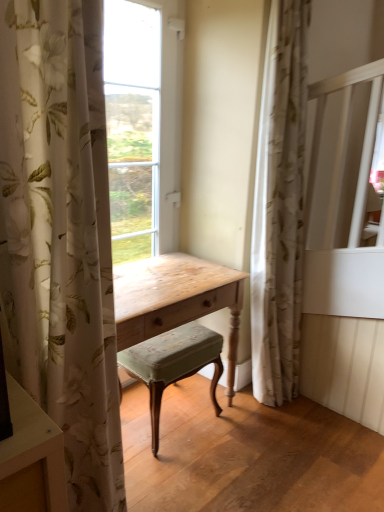
Question: From a real-world perspective, is velvet green cushioned stool at center on top of floral sheer curtain at right, which ranks as the second curtain in left-to-right order?

Choices:
 (A) no
 (B) yes

Answer: (A)

Question: Can you confirm if velvet green cushioned stool at center is shorter than floral sheer curtain at right, the first curtain from the back?

Choices:
 (A) yes
 (B) no

Answer: (A)

Question: Can you confirm if velvet green cushioned stool at center is smaller than floral sheer curtain at right, the second curtain viewed from the front?

Choices:
 (A) no
 (B) yes

Answer: (B)

Question: Does velvet green cushioned stool at center appear on the left side of floral sheer curtain at right, which ranks as the second curtain in left-to-right order?

Choices:
 (A) yes
 (B) no

Answer: (A)

Question: Is velvet green cushioned stool at center placed right next to floral sheer curtain at right, acting as the first curtain starting from the right?

Choices:
 (A) no
 (B) yes

Answer: (A)

Question: Is floral sheer curtain at right, the first curtain from the back, to the left or to the right of white floral fabric curtain at left, arranged as the 1th curtain when viewed from the front, in the image?

Choices:
 (A) right
 (B) left

Answer: (A)

Question: Do you think floral sheer curtain at right, the first curtain from the back, is within white floral fabric curtain at left, which appears as the 2th curtain when viewed from the back, or outside of it?

Choices:
 (A) inside
 (B) outside

Answer: (B)

Question: Is floral sheer curtain at right, acting as the first curtain starting from the right, in front of or behind white floral fabric curtain at left, which appears as the 2th curtain when viewed from the back, in the image?

Choices:
 (A) behind
 (B) front

Answer: (A)

Question: From a real-world perspective, is floral sheer curtain at right, acting as the first curtain starting from the right, above or below white floral fabric curtain at left, which appears as the 2th curtain when viewed from the back?

Choices:
 (A) above
 (B) below

Answer: (A)

Question: Looking at their shapes, would you say white floral fabric curtain at left, arranged as the 1th curtain when viewed from the front, is wider or thinner than floral sheer curtain at right, the first curtain from the back?

Choices:
 (A) wide
 (B) thin

Answer: (B)

Question: Considering the positions of point (79, 455) and point (296, 224), is point (79, 455) closer or farther from the camera than point (296, 224)?

Choices:
 (A) farther
 (B) closer

Answer: (B)

Question: Considering the positions of white floral fabric curtain at left, which appears as the 2th curtain when viewed from the back, and floral sheer curtain at right, the first curtain from the back, in the image, is white floral fabric curtain at left, which appears as the 2th curtain when viewed from the back, taller or shorter than floral sheer curtain at right, the first curtain from the back,?

Choices:
 (A) short
 (B) tall

Answer: (A)

Question: Visually, is white floral fabric curtain at left, the second curtain when ordered from right to left, positioned to the left or to the right of floral sheer curtain at right, acting as the first curtain starting from the right?

Choices:
 (A) left
 (B) right

Answer: (A)

Question: Is white floral fabric curtain at left, the second curtain when ordered from right to left, in front of or behind velvet green cushioned stool at center in the image?

Choices:
 (A) behind
 (B) front

Answer: (B)

Question: Considering the positions of white floral fabric curtain at left, arranged as the 1th curtain when viewed from the front, and velvet green cushioned stool at center in the image, is white floral fabric curtain at left, arranged as the 1th curtain when viewed from the front, bigger or smaller than velvet green cushioned stool at center?

Choices:
 (A) small
 (B) big

Answer: (B)